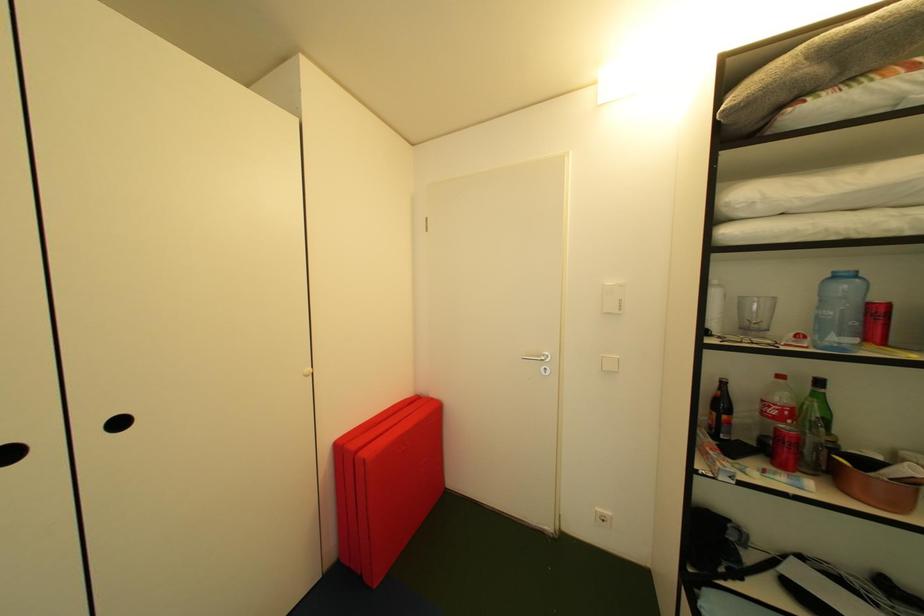
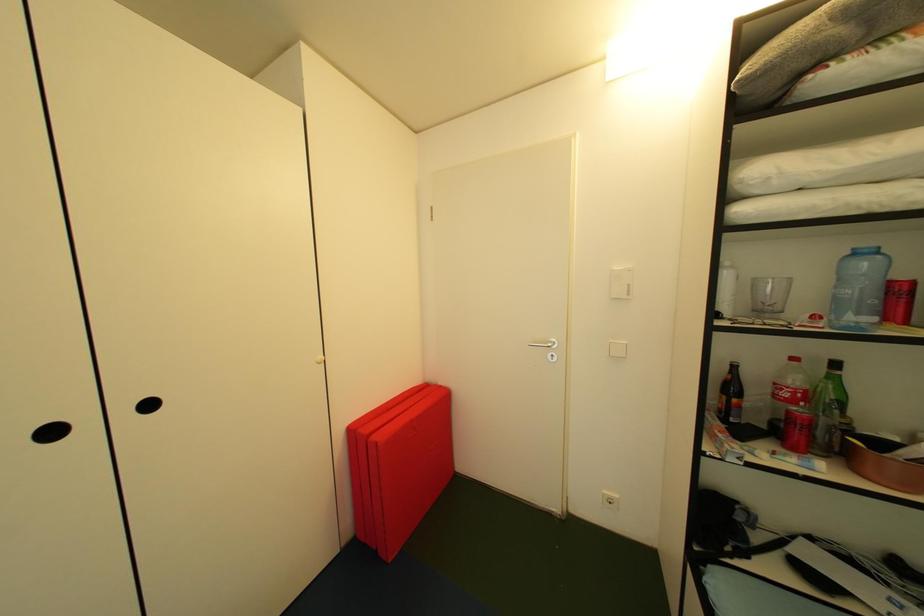
The images are taken continuously from a first-person perspective. In which direction are you moving?

The cameraman walked toward right, backward.